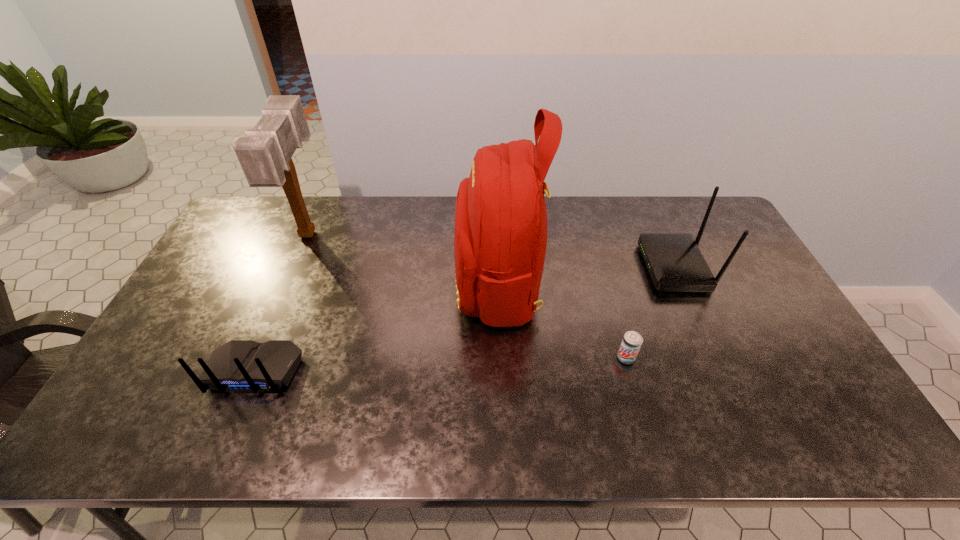
Locate an element on the screen. vacant region at the far edge is located at coordinates (315, 223).

In the image, there is a desktop. Identify the location of vacant area at the near edge. (513, 427).

Find the location of a particular element. The width and height of the screenshot is (960, 540). free space at the left edge of the desktop is located at coordinates (240, 296).

Image resolution: width=960 pixels, height=540 pixels. Find the location of `vacant position at the right edge of the desktop`. vacant position at the right edge of the desktop is located at coordinates (756, 307).

Where is `free space between the right router and the backpack`? The height and width of the screenshot is (540, 960). free space between the right router and the backpack is located at coordinates (587, 274).

Where is `free space between the shortest object and the nearer router`? free space between the shortest object and the nearer router is located at coordinates (441, 364).

This screenshot has width=960, height=540. In order to click on free space between the shorter router and the right router in this screenshot , I will do `click(465, 319)`.

You are a GUI agent. You are given a task and a screenshot of the screen. Output one action in this format:
    pyautogui.click(x=<x>, y=<y>)
    Task: Click on the free space between the taller router and the third object from left to right
    The height and width of the screenshot is (540, 960).
    Given the screenshot: What is the action you would take?
    pyautogui.click(x=587, y=274)

The image size is (960, 540). Identify the location of free point between the second object from right to left and the third object from left to right. (562, 320).

Locate an element on the screen. This screenshot has width=960, height=540. vacant region between the beer can and the backpack is located at coordinates (562, 320).